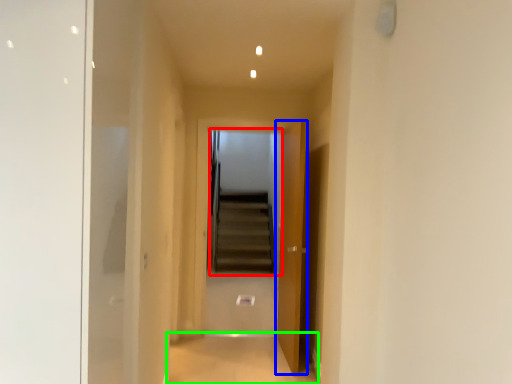
Question: Based on their relative distances, which object is nearer to escalator (highlighted by a red box)? Choose from door (highlighted by a blue box) and path (highlighted by a green box).

Choices:
 (A) door
 (B) path

Answer: (B)